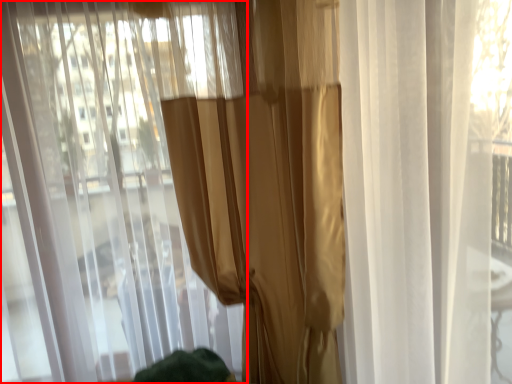
Question: From the image's perspective, what is the correct spatial relationship of curtain (annotated by the red box) in relation to curtain?

Choices:
 (A) above
 (B) below

Answer: (B)